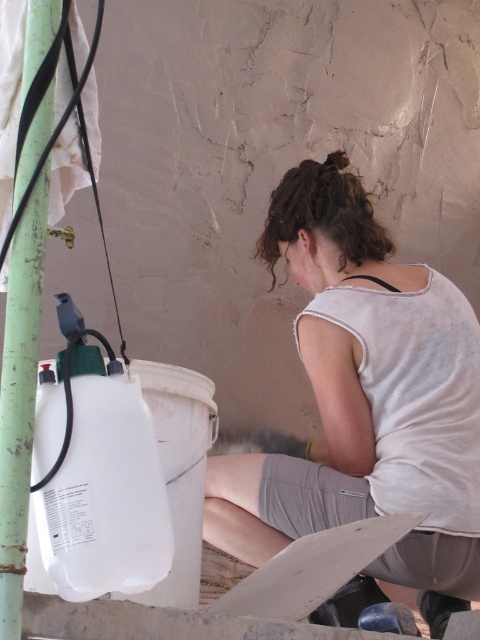
You are a painter observing a worker in a room. You see the white matte tank top at center and the green painted metal pole at left. Which object is closer to the floor?

The white matte tank top at center is below the green painted metal pole at left, so it is closer to the floor.

You are observing a worker in a construction site and notice two items near the worker. The items are the white matte tank top at center and the green painted metal pole at left. Which item is located to the right of the other?

The white matte tank top at center is positioned on the right side of green painted metal pole at left.

From the picture: You are a painter standing at the camera position. You need to reach the point marked at coordinates (328, 259) on the wall to apply some paint. Can you reach it without moving your position? The average arm length of a person is 0.7 meters.

The point at coordinates (328, 259) is 2.92 meters away from the camera. Since the average arm length is 0.7 meters, you cannot reach it without moving your position.